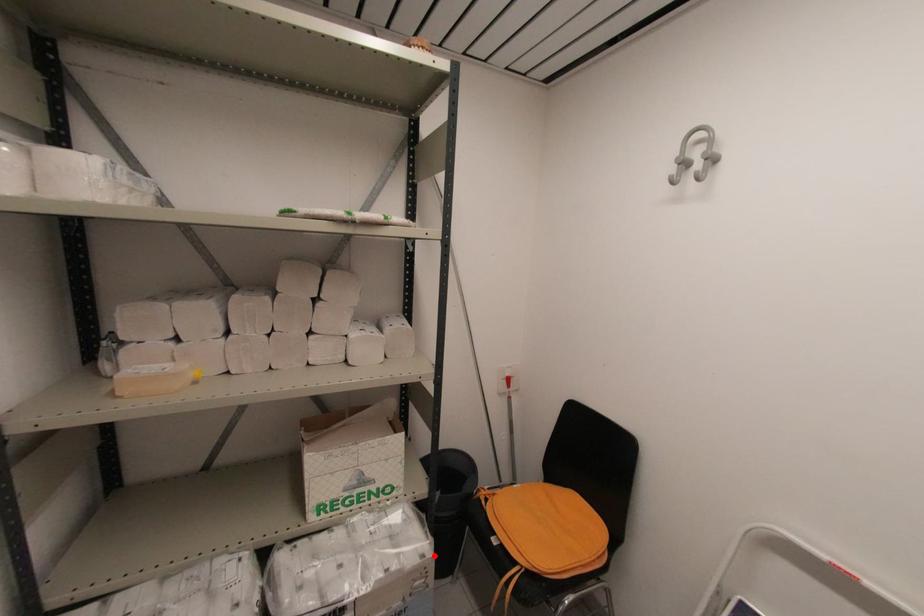
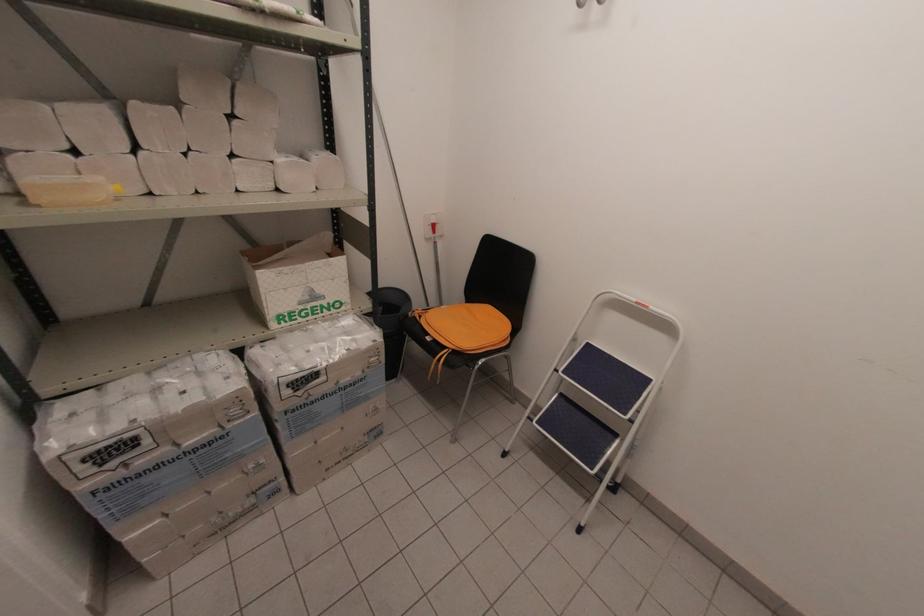
Question: I am providing you with two images of the same scene from different viewpoints. A red point is shown in image1. For the corresponding object point in image2, is it positioned nearer or farther from the camera?

Choices:
 (A) Nearer
 (B) Farther

Answer: (A)